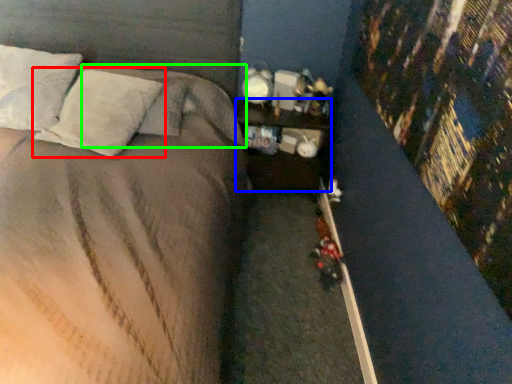
Question: Which object is positioned closest to pillow (highlighted by a red box)? Select from nightstand (highlighted by a blue box) and pillow (highlighted by a green box).

Choices:
 (A) nightstand
 (B) pillow

Answer: (B)